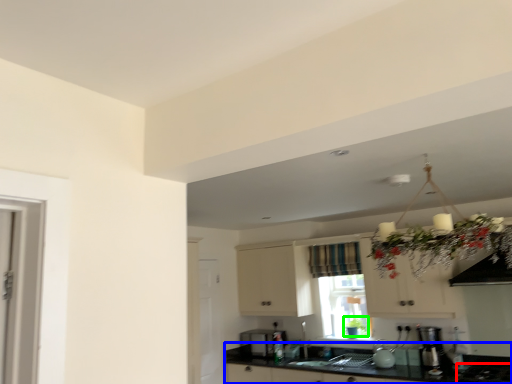
Question: Which object is positioned farthest from gas stove (highlighted by a red box)? Select from countertop (highlighted by a blue box) and plant (highlighted by a green box).

Choices:
 (A) countertop
 (B) plant

Answer: (B)